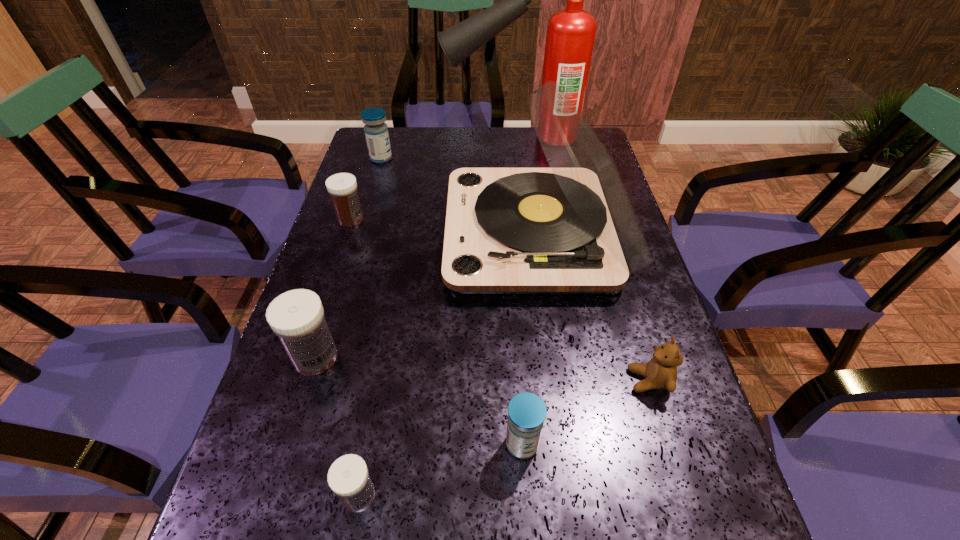
You are a GUI agent. You are given a task and a screenshot of the screen. Output one action in this format:
    pyautogui.click(x=<x>, y=<y>)
    Task: Click on the free region located 0.390m on the front of the farther blue medicine
    The image size is (960, 540).
    Given the screenshot: What is the action you would take?
    pyautogui.click(x=354, y=249)

Locate an element on the screen. vacant space situated 0.080m on the back of the biggest white medicine is located at coordinates (330, 308).

Identify the location of free space located on the back of the nearer blue medicine. The image size is (960, 540). (519, 396).

Where is `vacant region located on the back of the second farthest medicine`? The image size is (960, 540). vacant region located on the back of the second farthest medicine is located at coordinates (371, 156).

Image resolution: width=960 pixels, height=540 pixels. In order to click on vacant region located 0.350m on the front-facing side of the teddy bear in this screenshot , I will do `click(445, 380)`.

Locate an element on the screen. The width and height of the screenshot is (960, 540). free space located on the front-facing side of the teddy bear is located at coordinates (535, 380).

The image size is (960, 540). I want to click on free region located 0.220m on the front-facing side of the teddy bear, so coord(514,380).

At what (x,y) coordinates should I click in order to perform the action: click on vacant space positioned 0.370m on the right of the fourth medicine from left to right. Please return your answer as a coordinate pair (x, y). Looking at the image, I should click on (611, 495).

Locate an element on the screen. The height and width of the screenshot is (540, 960). fire extinguisher that is at the far edge is located at coordinates (570, 36).

Identify the location of medicine located at the far edge. This screenshot has height=540, width=960. (376, 131).